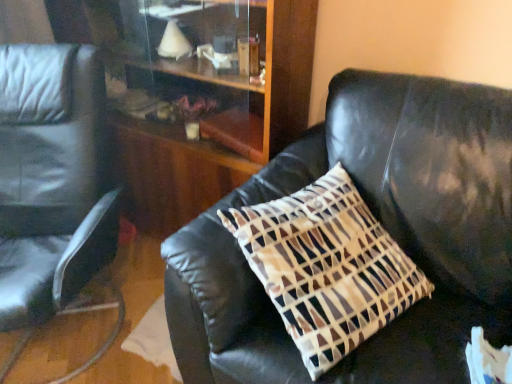
Identify the location of wooden dresser at center. The width and height of the screenshot is (512, 384). (222, 132).

In order to face velvet brown pillow at center, should I rotate leftwards or rightwards?

A 9.745 degree turn to the right will do.

The height and width of the screenshot is (384, 512). Find the location of `wooden dresser at center`. wooden dresser at center is located at coordinates (222, 132).

From a real-world perspective, relative to velvet brown pillow at center, is matte black chair at left vertically above or below?

From a real-world perspective, matte black chair at left is physically below velvet brown pillow at center.

In the scene shown: From the image's perspective, which is below, matte black chair at left or velvet brown pillow at center?

From the image's view, velvet brown pillow at center is below.

Between point (4, 107) and point (486, 150), which one is positioned in front?

The point (486, 150) is in front.

Is matte black chair at left oriented away from velvet brown pillow at center?

No, matte black chair at left is not facing the opposite direction of velvet brown pillow at center.

Considering the relative positions of wooden dresser at center and matte black chair at left in the image provided, is wooden dresser at center in front of matte black chair at left?

No.

Is wooden dresser at center facing away from matte black chair at left?

That's right, wooden dresser at center is facing away from matte black chair at left.

Find the location of a particular element. chair below the wooden dresser at center (from a real-world perspective) is located at coordinates (51, 179).

Does wooden dresser at center have a greater width compared to matte black chair at left?

No.

Is wooden dresser at center completely or partially inside velvet brown pillow at center?

Actually, wooden dresser at center is outside velvet brown pillow at center.

Considering the sizes of objects velvet brown pillow at center and wooden dresser at center in the image provided, who is taller, velvet brown pillow at center or wooden dresser at center?

wooden dresser at center.

From the image's perspective, between velvet brown pillow at center and wooden dresser at center, who is located below?

velvet brown pillow at center.

In the scene shown: From a real-world perspective, is velvet brown pillow at center positioned over wooden dresser at center based on gravity?

Actually, velvet brown pillow at center is physically below wooden dresser at center in the real world.

Considering the relative sizes of matte black chair at left and wooden dresser at center in the image provided, is matte black chair at left shorter than wooden dresser at center?

Correct, matte black chair at left is not as tall as wooden dresser at center.

Which is more to the right, matte black chair at left or wooden dresser at center?

From the viewer's perspective, wooden dresser at center appears more on the right side.

Is matte black chair at left oriented away from wooden dresser at center?

Correct, matte black chair at left is looking away from wooden dresser at center.

Measure the distance from matte black chair at left to wooden dresser at center.

They are 19.50 inches apart.

In the scene shown: Is velvet brown pillow at center wider than matte black chair at left?

In fact, velvet brown pillow at center might be narrower than matte black chair at left.

In order to click on chair below the velvet brown pillow at center (from a real-world perspective) in this screenshot , I will do `click(51, 179)`.

In the scene shown: From the image's perspective, does velvet brown pillow at center appear higher than matte black chair at left?

No, from the image's perspective, velvet brown pillow at center is not above matte black chair at left.

The width and height of the screenshot is (512, 384). What are the coordinates of `studio couch located on the right of wooden dresser at center` in the screenshot? It's located at point(384,227).

In the scene shown: Can we say wooden dresser at center lies outside velvet brown pillow at center?

Indeed, wooden dresser at center is completely outside velvet brown pillow at center.

Based on the photo, can you confirm if wooden dresser at center is thinner than velvet brown pillow at center?

Indeed, wooden dresser at center has a lesser width compared to velvet brown pillow at center.

Is point (126, 162) closer to camera compared to point (421, 186)?

That is False.

Identify the location of chair located behind the velvet brown pillow at center. The image size is (512, 384). (51, 179).

Image resolution: width=512 pixels, height=384 pixels. In order to click on dresser above the matte black chair at left (from a real-world perspective) in this screenshot , I will do `click(222, 132)`.

From the picture: From the image, which object appears to be farther from wooden dresser at center, matte black chair at left or velvet brown pillow at center?

Among the two, matte black chair at left is located further to wooden dresser at center.

In the scene shown: Based on their spatial positions, is wooden dresser at center or matte black chair at left further from velvet brown pillow at center?

matte black chair at left lies further to velvet brown pillow at center than the other object.

When comparing their distances from matte black chair at left, does velvet brown pillow at center or wooden dresser at center seem closer?

wooden dresser at center lies closer to matte black chair at left than the other object.

Which object lies nearer to the anchor point velvet brown pillow at center, matte black chair at left or wooden dresser at center?

Based on the image, wooden dresser at center appears to be nearer to velvet brown pillow at center.

Based on their spatial positions, is velvet brown pillow at center or matte black chair at left further from wooden dresser at center?

The object further to wooden dresser at center is matte black chair at left.

Looking at the image, which one is located further to matte black chair at left, wooden dresser at center or velvet brown pillow at center?

Among the two, velvet brown pillow at center is located further to matte black chair at left.

Locate an element on the screen. dresser located between matte black chair at left and velvet brown pillow at center in the left-right direction is located at coordinates (222, 132).